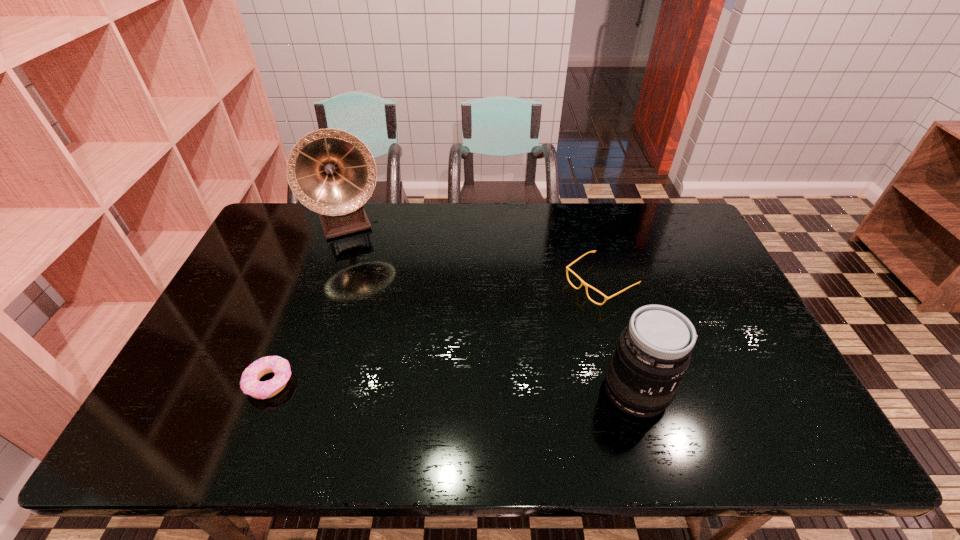
The image size is (960, 540). Identify the location of vacant spot on the desktop that is between the doughnut and the second tallest object and is positioned in front of the lenses of the second shortest object. (438, 386).

This screenshot has height=540, width=960. In order to click on vacant spot on the desktop that is between the doughnut and the telephoto lens and is positioned on the horn of the tallest object in this screenshot , I will do `click(413, 386)`.